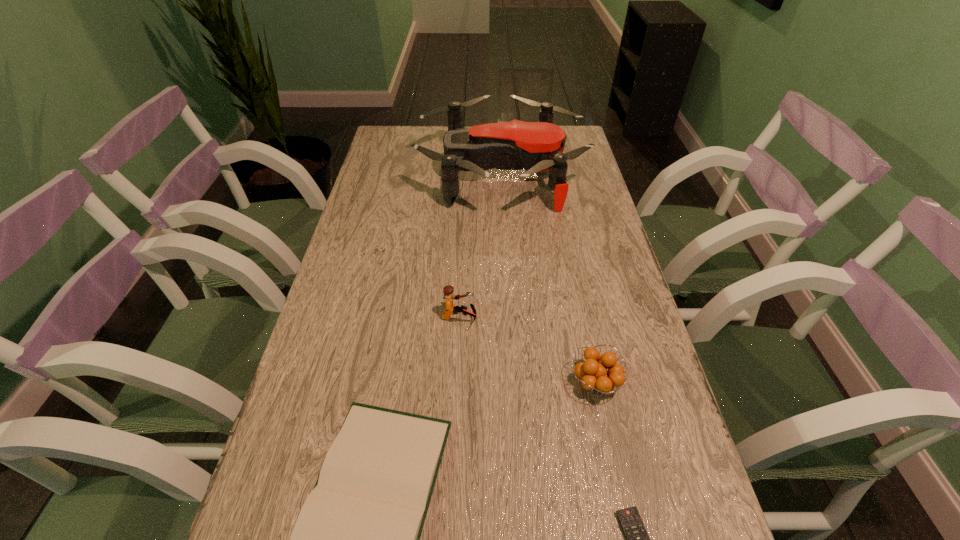
Find the location of a particular element. drone is located at coordinates (538, 146).

Where is `the farthest object`? The width and height of the screenshot is (960, 540). the farthest object is located at coordinates (538, 146).

The width and height of the screenshot is (960, 540). I want to click on Lego, so click(x=450, y=308).

You are a GUI agent. You are given a task and a screenshot of the screen. Output one action in this format:
    pyautogui.click(x=<x>, y=<y>)
    Task: Click on the third tallest object
    
    Given the screenshot: What is the action you would take?
    595,377

The height and width of the screenshot is (540, 960). Identify the location of blank space located on the camera side of the tallest object. (391, 173).

Find the location of a particular element. free space located on the camera side of the tallest object is located at coordinates click(x=381, y=173).

Identify the location of vacant space located 0.120m on the camera side of the tallest object. (381, 173).

At what (x,y) coordinates should I click in order to perform the action: click on vacant area located holding a crossbow in the hands of the Lego. Please return your answer as a coordinate pair (x, y). This screenshot has height=540, width=960. Looking at the image, I should click on (581, 318).

In order to click on free region located 0.260m on the left of the third shortest object in this screenshot , I will do `click(441, 383)`.

Identify the location of object that is at the far edge. The image size is (960, 540). (538, 146).